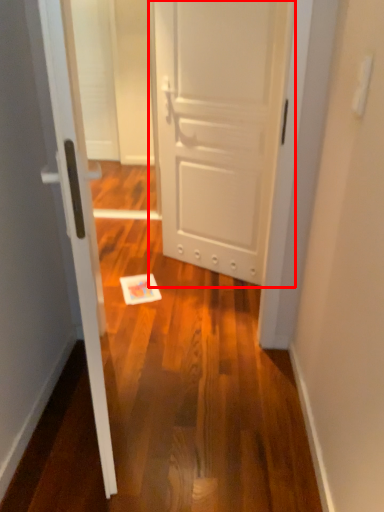
Question: Considering the relative positions of door (annotated by the red box) and door in the image provided, where is door (annotated by the red box) located with respect to the staircase?

Choices:
 (A) right
 (B) left

Answer: (A)